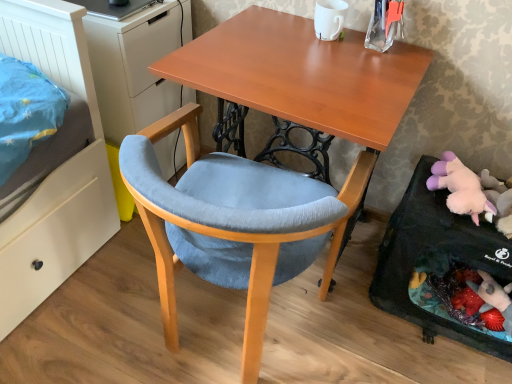
This screenshot has width=512, height=384. What do you see at coordinates (459, 187) in the screenshot?
I see `fluffy pink plush at lower right` at bounding box center [459, 187].

What do you see at coordinates (302, 74) in the screenshot? The image size is (512, 384). I see `wooden desk at center` at bounding box center [302, 74].

This screenshot has width=512, height=384. In order to click on fluffy pink plush at lower right in this screenshot , I will do `click(459, 187)`.

At what (x,y) coordinates should I click in order to perform the action: click on dresser on the left side of fluffy pink stuffed animal at lower right. Please return your answer as a coordinate pair (x, y). Image resolution: width=512 pixels, height=384 pixels. Looking at the image, I should click on (135, 66).

In the scene shown: From a real-world perspective, is matte white dresser at left positioned above or below fluffy pink stuffed animal at lower right?

matte white dresser at left is above fluffy pink stuffed animal at lower right.

From the image's perspective, which object appears higher, matte white dresser at left or fluffy pink stuffed animal at lower right?

matte white dresser at left, from the image's perspective.

Who is bigger, matte white dresser at left or fluffy pink stuffed animal at lower right?

matte white dresser at left is bigger.

Which is in front, point (483, 199) or point (291, 92)?

Positioned in front is point (291, 92).

Considering the relative sizes of fluffy pink plush at lower right and wooden desk at center in the image provided, is fluffy pink plush at lower right smaller than wooden desk at center?

Yes, fluffy pink plush at lower right is smaller than wooden desk at center.

What are the coordinates of `toy on the right of wooden desk at center` in the screenshot? It's located at coord(459,187).

Which object is further away from the camera, fluffy pink plush at lower right or wooden desk at center?

fluffy pink plush at lower right is further away from the camera.

Locate an element on the screen. The image size is (512, 384). desktop that is in front of the matte white dresser at left is located at coordinates (426, 247).

Considering the points (451, 220) and (79, 3), which point is in front, point (451, 220) or point (79, 3)?

The point (79, 3) is closer to the camera.

From the image's perspective, is fluffy pink stuffed animal at lower right above matte white dresser at left?

No, from the image's perspective, fluffy pink stuffed animal at lower right is not over matte white dresser at left.

Considering the sizes of objects fluffy pink stuffed animal at lower right and matte white dresser at left in the image provided, who is smaller, fluffy pink stuffed animal at lower right or matte white dresser at left?

Smaller between the two is fluffy pink stuffed animal at lower right.

Is wooden desk at center positioned with its back to matte white dresser at left?

That's not correct — wooden desk at center is not looking away from matte white dresser at left.

Between point (232, 34) and point (129, 44), which one is positioned in front?

The point (232, 34) is more forward.

Considering the relative sizes of wooden desk at center and matte white dresser at left in the image provided, is wooden desk at center bigger than matte white dresser at left?

Yes, wooden desk at center is bigger than matte white dresser at left.

Is velvet blue chair at center far from wooden desk at center?

That's not correct — velvet blue chair at center is a little close to wooden desk at center.

Looking at this image, measure the distance from velvet blue chair at center to wooden desk at center.

A distance of 12.16 inches exists between velvet blue chair at center and wooden desk at center.

Considering the relative sizes of velvet blue chair at center and wooden desk at center in the image provided, is velvet blue chair at center smaller than wooden desk at center?

Yes, velvet blue chair at center is smaller than wooden desk at center.

From a real-world perspective, which is physically below, velvet blue chair at center or wooden desk at center?

velvet blue chair at center.

Consider the image. Which object is thinner, fluffy pink stuffed animal at lower right or velvet blue chair at center?

fluffy pink stuffed animal at lower right is thinner.

From a real-world perspective, which object rests below the other?

In real-world perspective, fluffy pink stuffed animal at lower right is lower.

Is fluffy pink stuffed animal at lower right positioned with its back to velvet blue chair at center?

fluffy pink stuffed animal at lower right does not have its back to velvet blue chair at center.

Between fluffy pink stuffed animal at lower right and velvet blue chair at center, which one has less height?

fluffy pink stuffed animal at lower right.

From a real-world perspective, is wooden desk at center positioned above or below fluffy pink plush at lower right?

From a real-world perspective, wooden desk at center is physically below fluffy pink plush at lower right.

Would you say wooden desk at center is to the left or to the right of fluffy pink plush at lower right in the picture?

In the image, wooden desk at center appears on the left side of fluffy pink plush at lower right.

Who is taller, wooden desk at center or fluffy pink plush at lower right?

wooden desk at center is taller.

This screenshot has width=512, height=384. In order to click on desktop that appears on the right of matte white dresser at left in this screenshot , I will do `click(426, 247)`.

Find the location of a particular element. The width and height of the screenshot is (512, 384). toy above the wooden desk at center (from a real-world perspective) is located at coordinates (459, 187).

Estimate the real-world distances between objects in this image. Which object is further from fluffy pink plush at lower right, fluffy pink stuffed animal at lower right or velvet blue chair at center?

Among the two, velvet blue chair at center is located further to fluffy pink plush at lower right.

From the image, which object appears to be farther from fluffy pink stuffed animal at lower right, velvet blue chair at center or wooden desk at center?

wooden desk at center.

Estimate the real-world distances between objects in this image. Which object is closer to velvet blue chair at center, fluffy pink plush at lower right or matte white dresser at left?

matte white dresser at left is positioned closer to the anchor velvet blue chair at center.

From the image, which object appears to be farther from velvet blue chair at center, fluffy pink stuffed animal at lower right or wooden desk at center?

fluffy pink stuffed animal at lower right lies further to velvet blue chair at center than the other object.

Based on the photo, when comparing their distances from wooden desk at center, does fluffy pink plush at lower right or velvet blue chair at center seem closer?

Based on the image, velvet blue chair at center appears to be nearer to wooden desk at center.

When comparing their distances from matte white dresser at left, does fluffy pink plush at lower right or velvet blue chair at center seem closer?

velvet blue chair at center.

From the image, which object appears to be farther from fluffy pink plush at lower right, matte white dresser at left or velvet blue chair at center?

Among the two, matte white dresser at left is located further to fluffy pink plush at lower right.

When comparing their distances from fluffy pink stuffed animal at lower right, does wooden desk at center or matte white dresser at left seem further?

matte white dresser at left is positioned further to the anchor fluffy pink stuffed animal at lower right.

Image resolution: width=512 pixels, height=384 pixels. Find the location of `desk between matte white dresser at left and fluffy pink plush at lower right in the horizontal direction`. desk between matte white dresser at left and fluffy pink plush at lower right in the horizontal direction is located at coordinates (302, 74).

You are a GUI agent. You are given a task and a screenshot of the screen. Output one action in this format:
    pyautogui.click(x=<x>, y=<y>)
    Task: Click on the toy situated between matte white dresser at left and fluffy pink stuffed animal at lower right from left to right
    
    Given the screenshot: What is the action you would take?
    pyautogui.click(x=459, y=187)

Find the location of `toy between velvet blue chair at center and fluffy pink stuffed animal at lower right`. toy between velvet blue chair at center and fluffy pink stuffed animal at lower right is located at coordinates (459, 187).

You are a GUI agent. You are given a task and a screenshot of the screen. Output one action in this format:
    pyautogui.click(x=<x>, y=<y>)
    Task: Click on the toy situated between wooden desk at center and fluffy pink stuffed animal at lower right from left to right
    This screenshot has height=384, width=512.
    Given the screenshot: What is the action you would take?
    pyautogui.click(x=459, y=187)